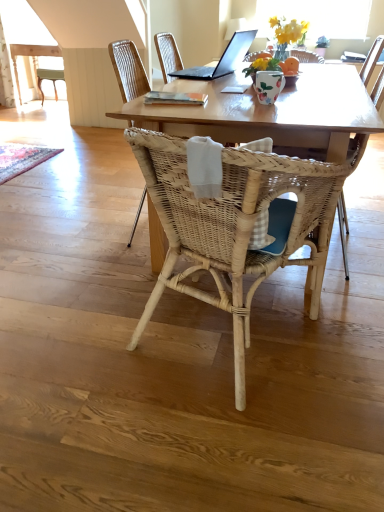
Locate an element on the screen. Image resolution: width=384 pixels, height=512 pixels. vacant region to the left of natural wood table at center is located at coordinates coord(80,207).